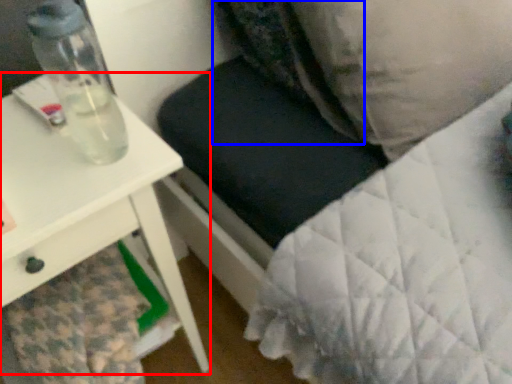
Question: Among these objects, which one is farthest to the camera, table (highlighted by a red box) or pillow (highlighted by a blue box)?

Choices:
 (A) table
 (B) pillow

Answer: (B)